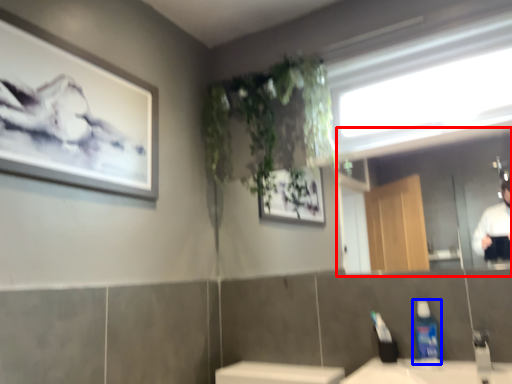
Question: Among these objects, which one is nearest to the camera, mirror (highlighted by a red box) or cleaning product (highlighted by a blue box)?

Choices:
 (A) mirror
 (B) cleaning product

Answer: (A)